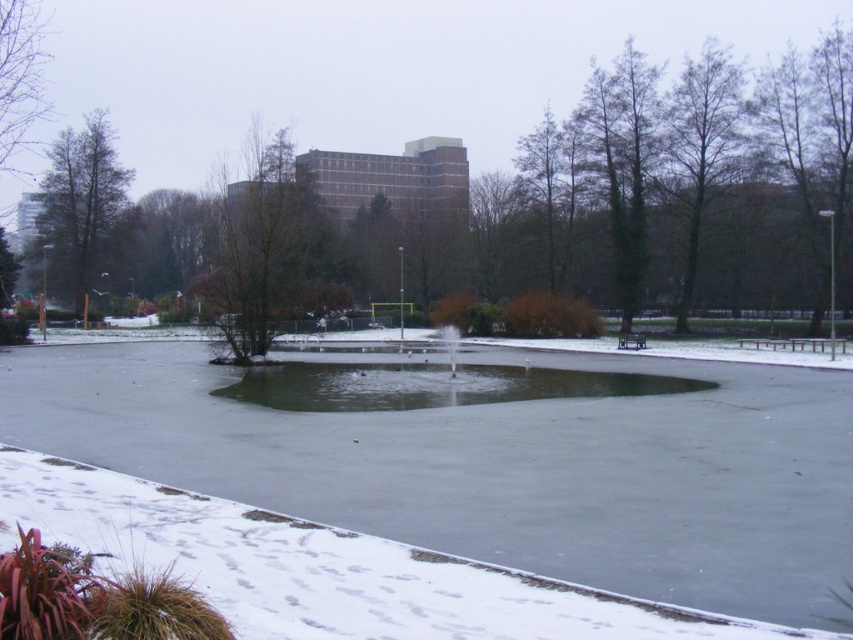
Is green matte tree at center positioned at the back of bare branches at upper right?

That is False.

From the picture: Does green matte tree at center appear on the left side of bare branches at upper right?

Correct, you'll find green matte tree at center to the left of bare branches at upper right.

Which is behind, point (302, 310) or point (729, 115)?

The point (729, 115) is behind.

At what (x,y) coordinates should I click in order to perform the action: click on green matte tree at center. Please return your answer as a coordinate pair (x, y). Looking at the image, I should click on (265, 250).

Between bare branches at upper right and green matte tree at left, which one appears on the left side from the viewer's perspective?

Positioned to the left is green matte tree at left.

Does bare branches at upper right have a greater height compared to green matte tree at left?

Yes, bare branches at upper right is taller than green matte tree at left.

Is point (720, 189) positioned after point (96, 131)?

No.

Find the location of `bare branches at upper right`. bare branches at upper right is located at coordinates point(700,147).

Does green matte tree at center have a lesser width compared to green matte tree at left?

In fact, green matte tree at center might be wider than green matte tree at left.

Who is more distant from viewer, (270, 276) or (106, 186)?

The point (106, 186) is behind.

Find the location of a particular element. green matte tree at center is located at coordinates (265, 250).